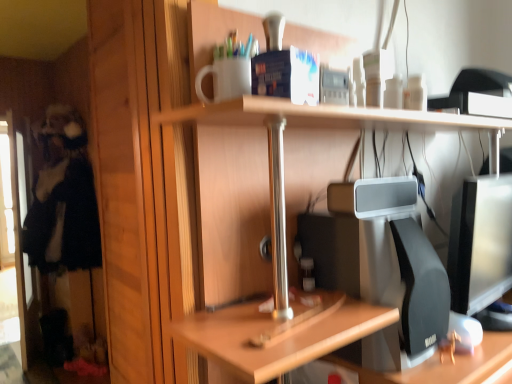
Question: From a real-world perspective, is transparent glass screen door at left positioned above or below black plush toy at left?

Choices:
 (A) above
 (B) below

Answer: (B)

Question: Considering the relative positions of transparent glass screen door at left and black plush toy at left in the image provided, is transparent glass screen door at left to the left or to the right of black plush toy at left?

Choices:
 (A) right
 (B) left

Answer: (B)

Question: Considering the positions of transparent glass screen door at left and black plush toy at left in the image, is transparent glass screen door at left taller or shorter than black plush toy at left?

Choices:
 (A) tall
 (B) short

Answer: (A)

Question: From a real-world perspective, is black plush toy at left above or below transparent glass screen door at left?

Choices:
 (A) below
 (B) above

Answer: (B)

Question: Do you think black plush toy at left is within transparent glass screen door at left, or outside of it?

Choices:
 (A) inside
 (B) outside

Answer: (B)

Question: From the image's perspective, is black plush toy at left positioned above or below transparent glass screen door at left?

Choices:
 (A) below
 (B) above

Answer: (B)

Question: Relative to transparent glass screen door at left, is black plush toy at left in front or behind?

Choices:
 (A) behind
 (B) front

Answer: (B)